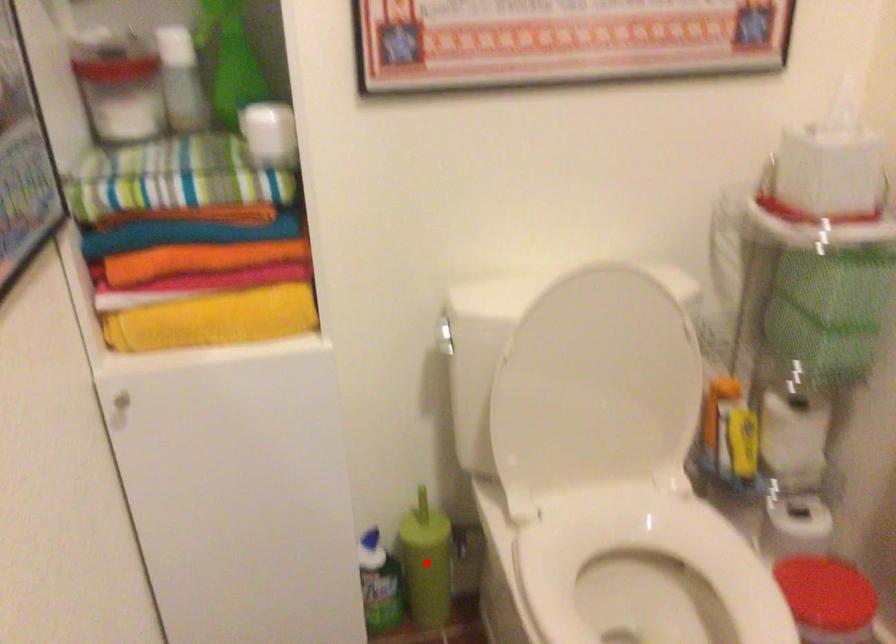
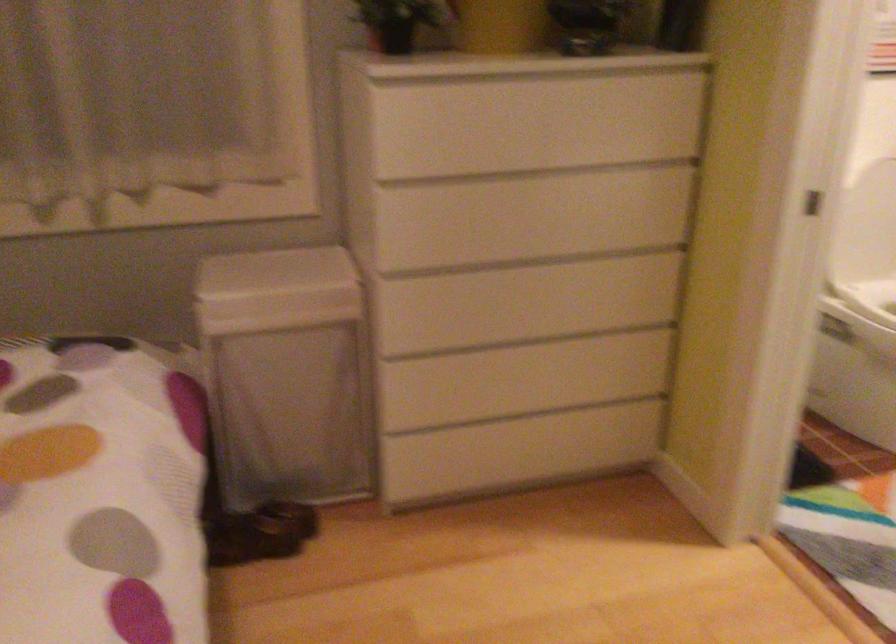
Question: I am providing you with two images of the same scene from different viewpoints. A red point is marked on the first image. Is the red point's position out of view in image 2?

Choices:
 (A) Yes
 (B) No

Answer: (A)